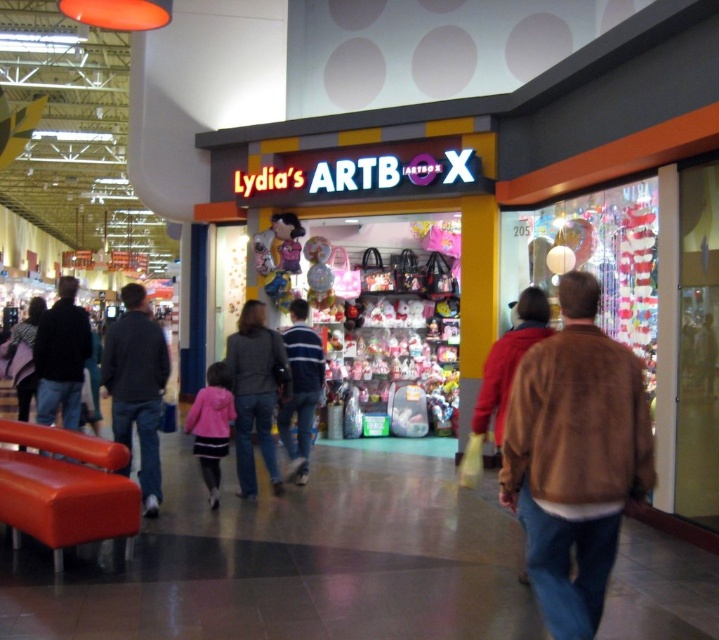
Can you confirm if brown suede jacket at lower right is bigger than dark gray sweater at center?

No, brown suede jacket at lower right is not bigger than dark gray sweater at center.

Does brown suede jacket at lower right appear on the left side of dark gray sweater at center?

Incorrect, brown suede jacket at lower right is not on the left side of dark gray sweater at center.

Identify the location of brown suede jacket at lower right. (574, 458).

Who is more distant from viewer, [536,544] or [87,328]?

The point [87,328] is more distant.

This screenshot has height=640, width=719. Identify the location of brown suede jacket at lower right. (574, 458).

You are a GUI agent. You are given a task and a screenshot of the screen. Output one action in this format:
    pyautogui.click(x=<x>, y=<y>)
    Task: Click on the brown suede jacket at lower right
    This screenshot has height=640, width=719.
    Given the screenshot: What is the action you would take?
    pyautogui.click(x=574, y=458)

Is dark gray sweater at center thinner than dark brown leather jacket at left?

Incorrect, dark gray sweater at center's width is not less than dark brown leather jacket at left's.

Can you confirm if dark gray sweater at center is taller than dark brown leather jacket at left?

Yes.

Is point (141, 355) in front of point (73, 406)?

That is True.

Locate an element on the screen. This screenshot has height=640, width=719. dark gray sweater at center is located at coordinates (137, 387).